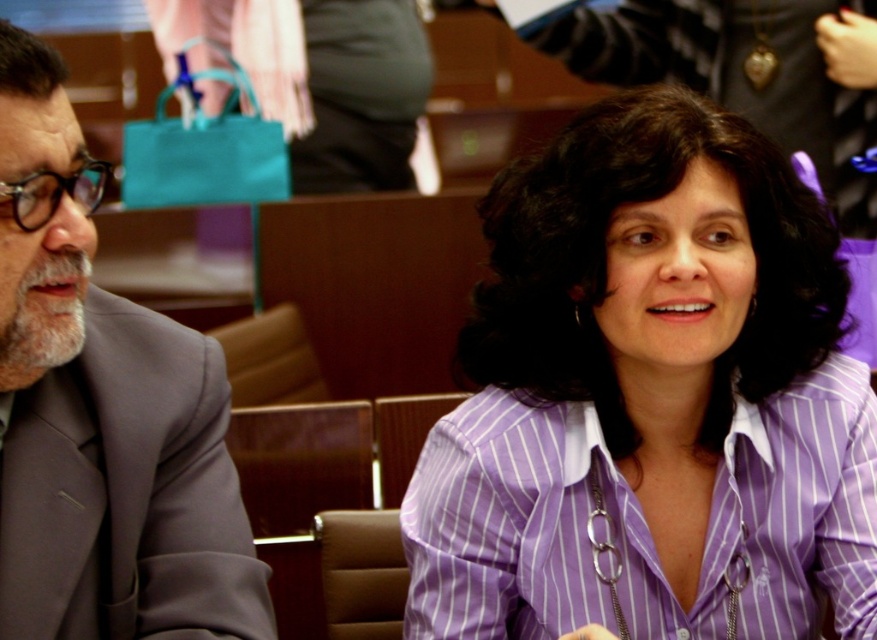
You are an event planner arranging seating for an important meeting. You have to place a name tag on the purple striped shirt at center and the matte gray suit at left. According to the image, where should you place each name tag so they are visible from the front? Explain your reasoning based on their positions.

The purple striped shirt at center is below the matte gray suit at left. Therefore, the name tag for the purple striped shirt at center should be placed on the lower part of the shirt, while the name tag for the matte gray suit at left should be positioned higher on the suit jacket to ensure visibility from the front.

You are standing at the entrance of the conference room and need to locate the purple striped shirt at center. According to the coordinates provided, where would you look to find it?

The purple striped shirt at center is located at coordinates point 0.623 on the x axis and 0.742 on the y axis.

You are a security guard in the conference room. You need to check if the purple striped shirt at center and the matte gray suit at left are within the 2 feet social distancing guideline. Can you confirm?

The distance between the purple striped shirt at center and the matte gray suit at left is 17.83 inches, which is less than 24 inches required for 2 feet social distancing. Therefore, they are not within the guideline.